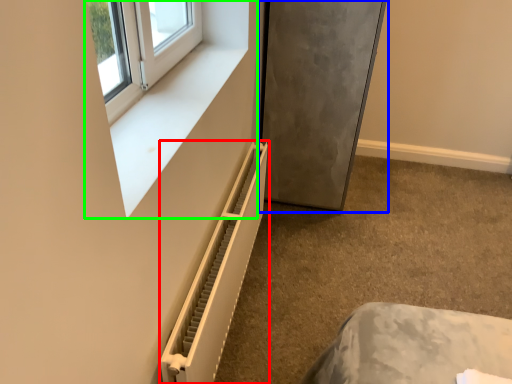
Question: Which is nearer to the radiator (highlighted by a red box)? fridge (highlighted by a blue box) or window frame (highlighted by a green box).

Choices:
 (A) fridge
 (B) window frame

Answer: (B)